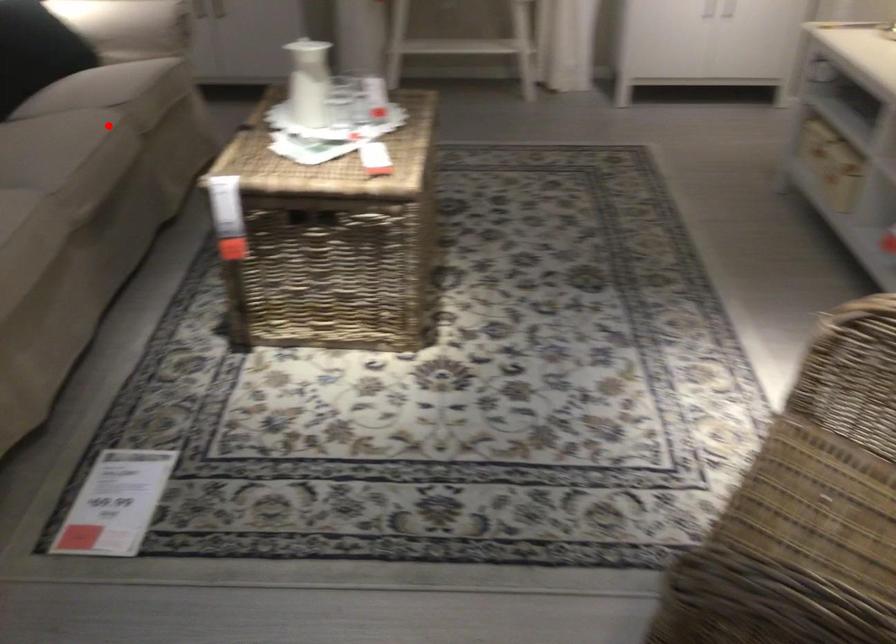
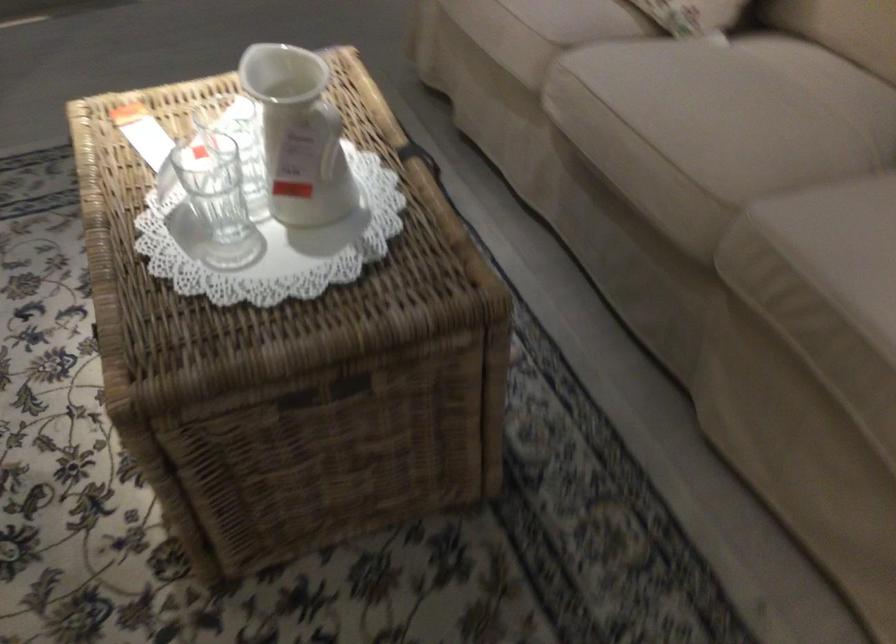
Locate, in the second image, the point that corresponds to the highlighted location in the first image.

(704, 167)